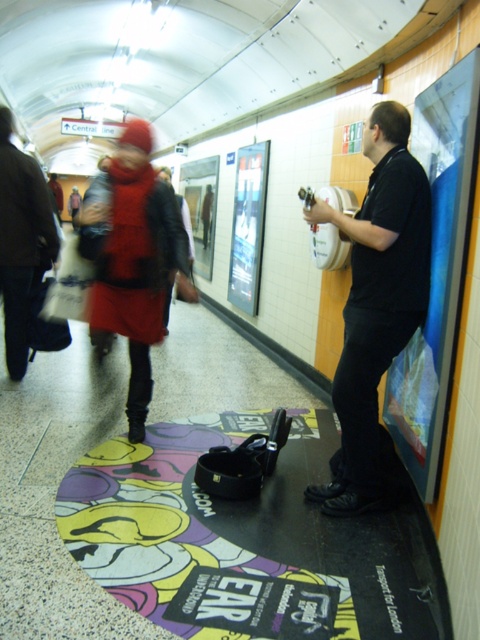
Question: Is matte plastic poster at right above metallic silver poster at center?

Choices:
 (A) yes
 (B) no

Answer: (B)

Question: Which object appears closest to the camera in this image?

Choices:
 (A) matte black coat at center
 (B) black matte shirt at center
 (C) multicolored fabric mat at center

Answer: (C)

Question: Among these objects, which one is nearest to the camera?

Choices:
 (A) matte plastic poster at right
 (B) velvet red coat at left
 (C) matte black coat at center
 (D) multicolored fabric mat at center

Answer: (D)

Question: Which is nearer to the black matte shirt at center?

Choices:
 (A) metallic silver poster at center
 (B) multicolored fabric mat at center
 (C) matte plastic poster at right

Answer: (C)

Question: Is black matte shirt at center positioned at the back of velvet red coat at left?

Choices:
 (A) no
 (B) yes

Answer: (A)

Question: Does black matte shirt at center appear over matte black coat at center?

Choices:
 (A) no
 (B) yes

Answer: (A)